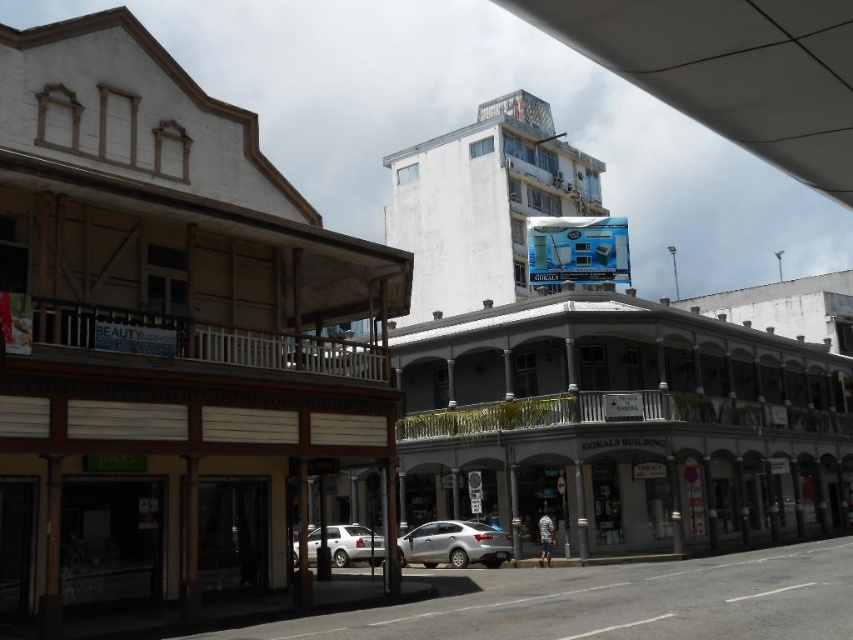
Measure the distance between point (459, 556) and camera.

26.39 meters

Does silver metallic sedan at center have a lesser height compared to satin silver car at center?

Incorrect, silver metallic sedan at center's height does not fall short of satin silver car at center's.

Which is behind, point (456, 554) or point (379, 552)?

The point (379, 552) is behind.

Identify the location of silver metallic sedan at center. (454, 545).